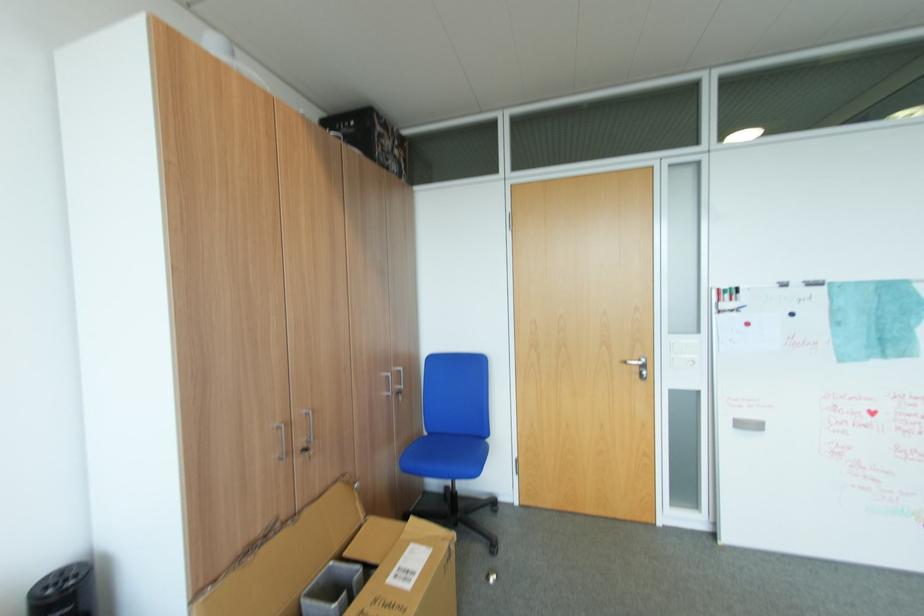
What do you see at coordinates (457, 468) in the screenshot?
I see `a blue chair sitting surface` at bounding box center [457, 468].